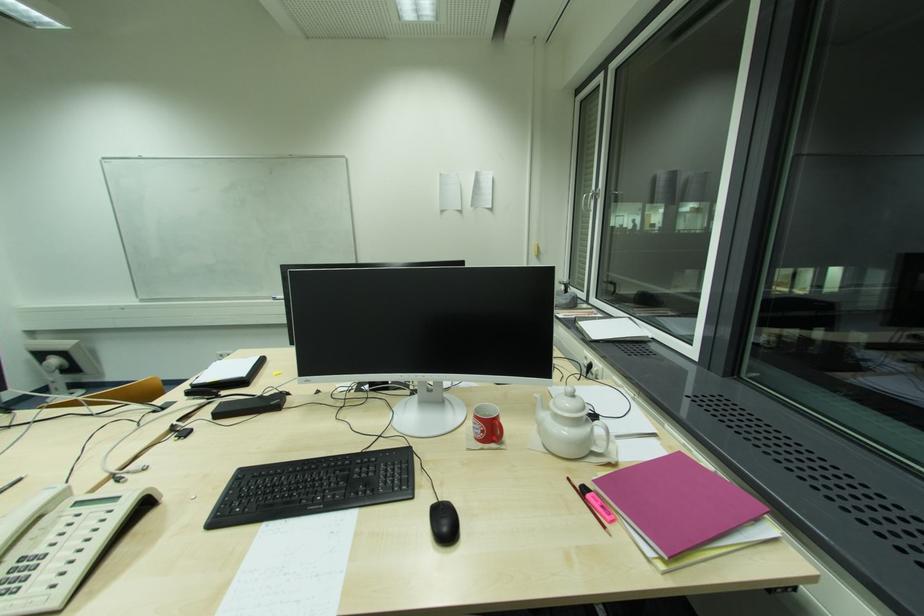
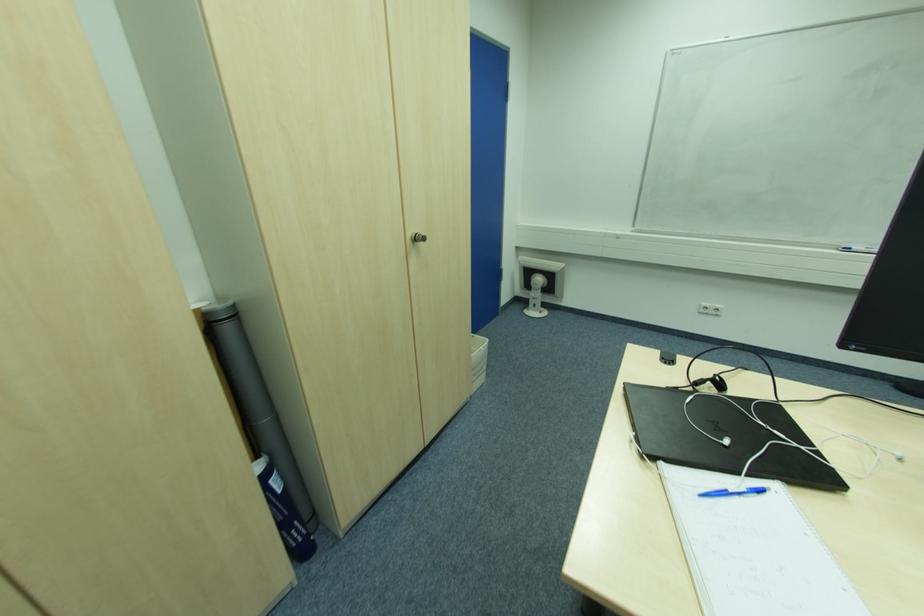
Where in the second image is the point corresponding to the point at 55,383 from the first image?

(536, 300)